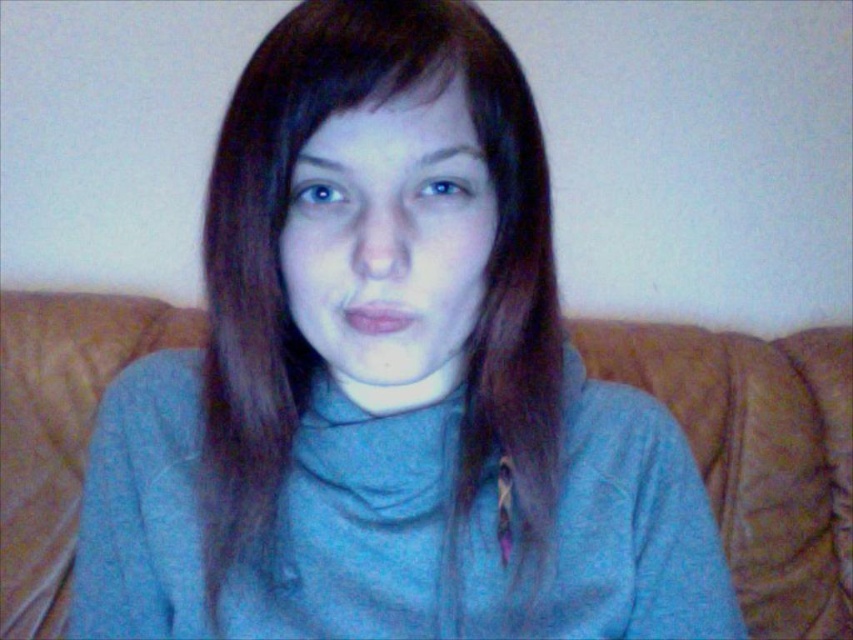
You are an interior designer analyzing the seating arrangement in the living room. You need to place a small decorative item exactly at the point indicated by the coordinates point (x=390, y=234). What object is located at that position?

The point (x=390, y=234) indicates the matte gray face at center, so the decorative item would be placed at the matte gray face at center.

You are an interior designer assessing the layout of a living room. You notice the brown leather couch at center and the matte gray face at center. Which object is taller in the scene?

The brown leather couch at center is taller than the matte gray face at center.

You are an artist sketching a portrait of the person in the image. You want to ensure the proportions are accurate. Which part of the person has a greater width in the image, the matte gray face at center or the brown matte hair at upper center?

The matte gray face at center has a greater width than the brown matte hair at upper center in the image.